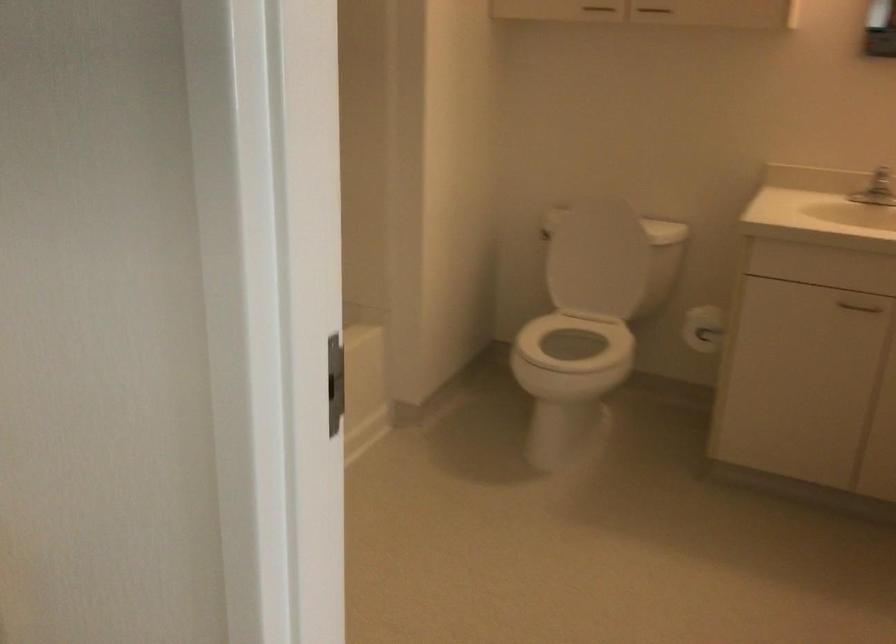
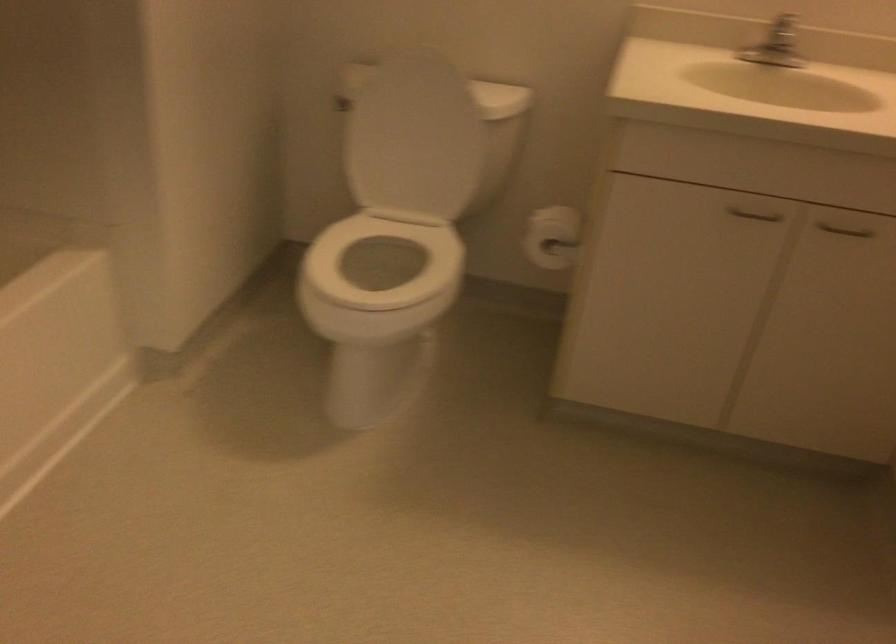
Question: In a continuous first-person perspective shot, in which direction is the camera moving?

Choices:
 (A) Left
 (B) Right
 (C) Forward
 (D) Backward

Answer: (C)